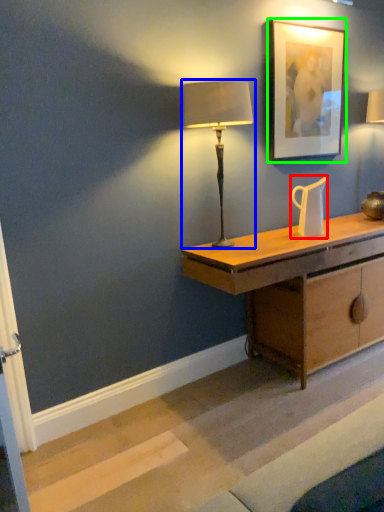
Question: Based on their relative distances, which object is farther from jug (highlighted by a red box)? Choose from lamp (highlighted by a blue box) and picture frame (highlighted by a green box).

Choices:
 (A) lamp
 (B) picture frame

Answer: (A)